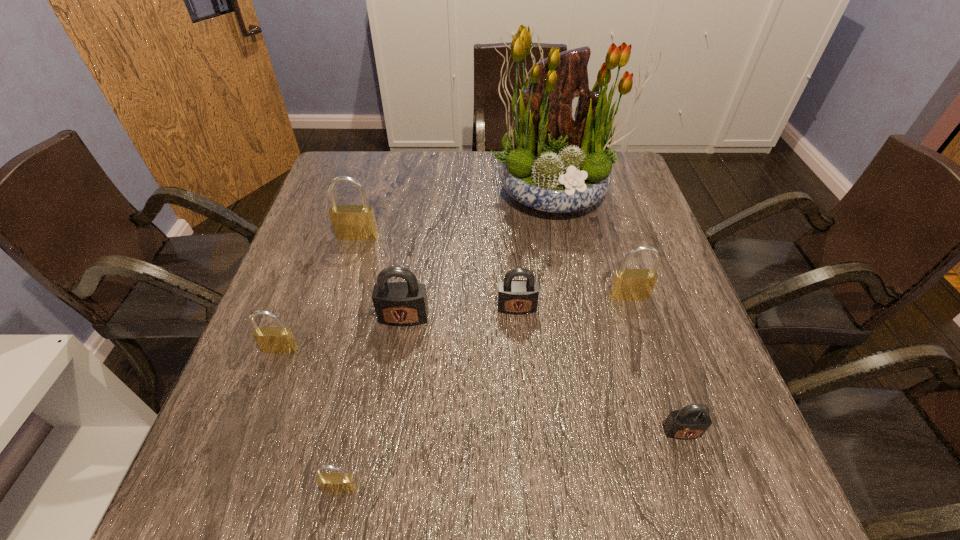
At what (x,y) coordinates should I click in order to perform the action: click on the closest object to the second biggest gray padlock. Please return your answer as a coordinate pair (x, y). The width and height of the screenshot is (960, 540). Looking at the image, I should click on (402, 304).

At what (x,y) coordinates should I click in order to perform the action: click on object that can be found as the third closest to the third smallest brass padlock. Please return your answer as a coordinate pair (x, y). The image size is (960, 540). Looking at the image, I should click on (692, 421).

Identify which padlock is the third nearest to the farthest brass padlock. Please provide its 2D coordinates. Your answer should be formatted as a tuple, i.e. [(x, y)], where the tuple contains the x and y coordinates of a point satisfying the conditions above.

[(517, 297)]

Locate which padlock is the fifth closest to the tallest object. Please provide its 2D coordinates. Your answer should be formatted as a tuple, i.e. [(x, y)], where the tuple contains the x and y coordinates of a point satisfying the conditions above.

[(692, 421)]

At what (x,y) coordinates should I click in order to perform the action: click on brass padlock that is the closest to the smallest gray padlock. Please return your answer as a coordinate pair (x, y). The width and height of the screenshot is (960, 540). Looking at the image, I should click on (628, 284).

Where is `brass padlock that can be found as the second closest to the biggest gray padlock`? The image size is (960, 540). brass padlock that can be found as the second closest to the biggest gray padlock is located at coordinates (350, 222).

Identify which gray padlock is located as the nearest to the biggest gray padlock. Please provide its 2D coordinates. Your answer should be formatted as a tuple, i.e. [(x, y)], where the tuple contains the x and y coordinates of a point satisfying the conditions above.

[(517, 297)]

Locate an element on the screen. This screenshot has width=960, height=540. the second closest gray padlock to the leftmost brass padlock is located at coordinates (517, 297).